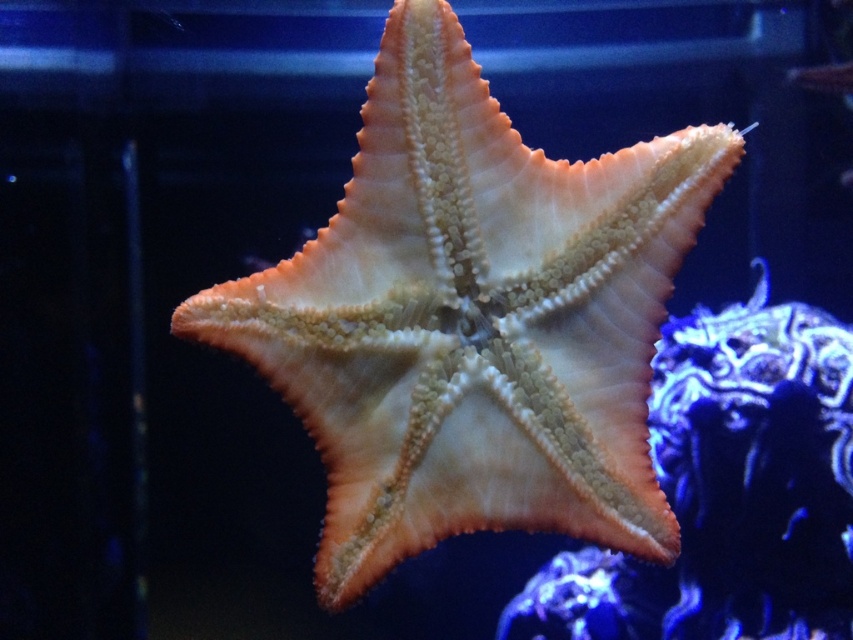
Which is more to the left, orange textured starfish at center or orange rough starfish at center?

orange textured starfish at center is more to the left.

The height and width of the screenshot is (640, 853). I want to click on orange textured starfish at center, so click(473, 320).

This screenshot has height=640, width=853. Describe the element at coordinates (473, 320) in the screenshot. I see `orange textured starfish at center` at that location.

At what (x,y) coordinates should I click in order to perform the action: click on orange textured starfish at center. Please return your answer as a coordinate pair (x, y). Looking at the image, I should click on (x=473, y=320).